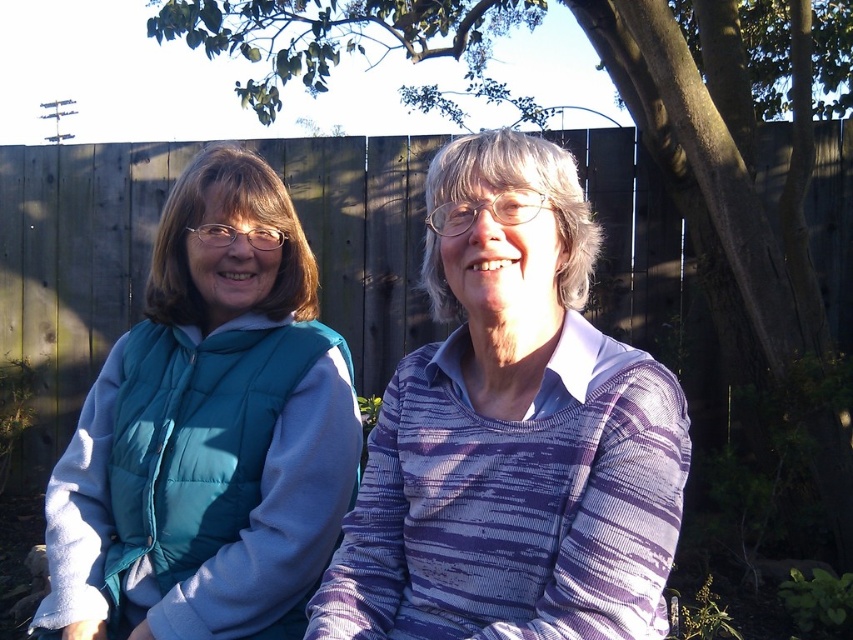
Question: Among these points, which one is nearest to the camera?

Choices:
 (A) (445, 156)
 (B) (85, 454)

Answer: (A)

Question: Is striped sweater at center above teal puffer vest at left?

Choices:
 (A) yes
 (B) no

Answer: (A)

Question: Which point is closer to the camera?

Choices:
 (A) striped sweater at center
 (B) teal puffer vest at left

Answer: (A)

Question: Is striped sweater at center positioned in front of teal puffer vest at left?

Choices:
 (A) no
 (B) yes

Answer: (B)

Question: Considering the relative positions of striped sweater at center and teal puffer vest at left in the image provided, where is striped sweater at center located with respect to teal puffer vest at left?

Choices:
 (A) left
 (B) right

Answer: (B)